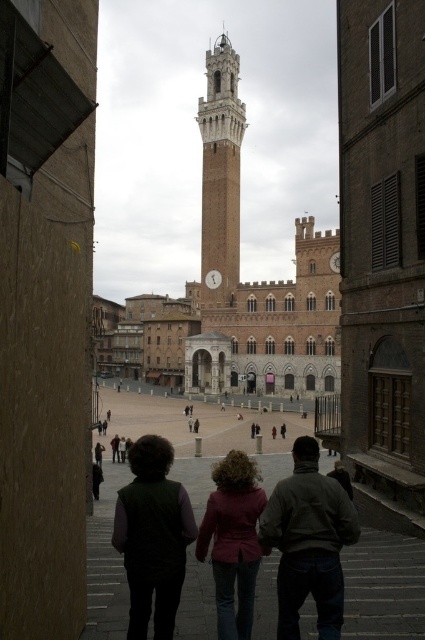
Question: Is sandy brown stone clock tower at center positioned at the back of maroon fabric coat at center?

Choices:
 (A) yes
 (B) no

Answer: (A)

Question: Among these points, which one is farthest from the camera?

Choices:
 (A) (331, 488)
 (B) (218, 625)
 (C) (336, 468)
 (D) (218, 86)

Answer: (D)

Question: Does dark gray sweater at center come behind sandy brown stone clock tower at center?

Choices:
 (A) no
 (B) yes

Answer: (A)

Question: Can you confirm if dark gray sweater at center is positioned to the right of dark green vest at lower left?

Choices:
 (A) yes
 (B) no

Answer: (A)

Question: Which object is closer to the camera taking this photo?

Choices:
 (A) dark brown leather jacket at lower center
 (B) dark brown leather jacket at lower left
 (C) maroon fabric coat at center

Answer: (C)

Question: Which point is closer to the camera taking this photo?

Choices:
 (A) (141, 440)
 (B) (295, 612)

Answer: (B)